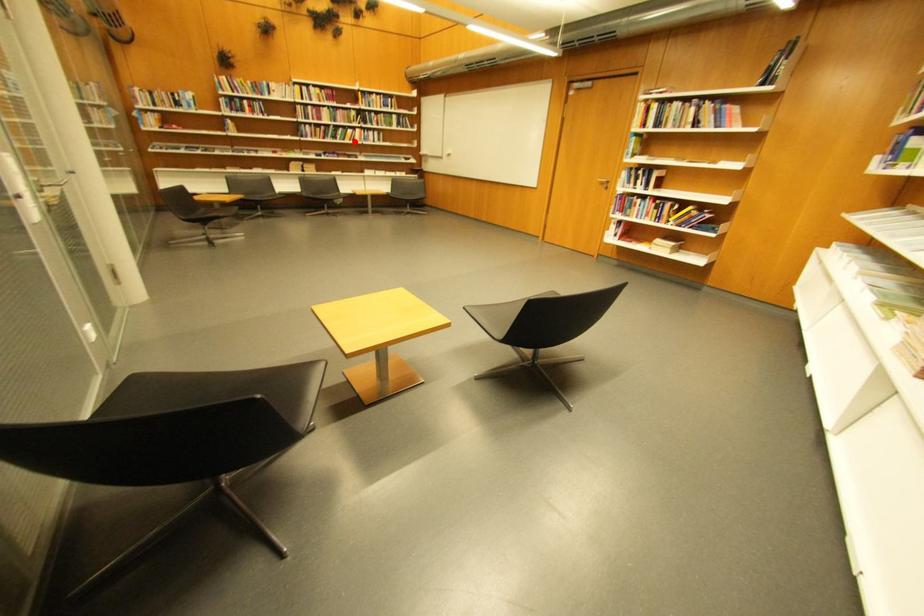
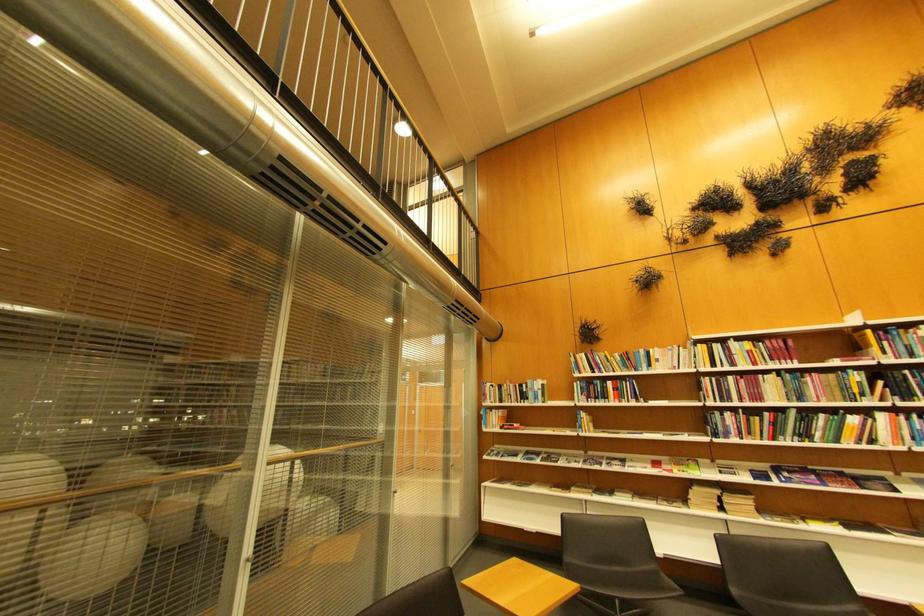
Locate, in the second image, the point that corresponds to the highlighted location in the first image.

(847, 443)